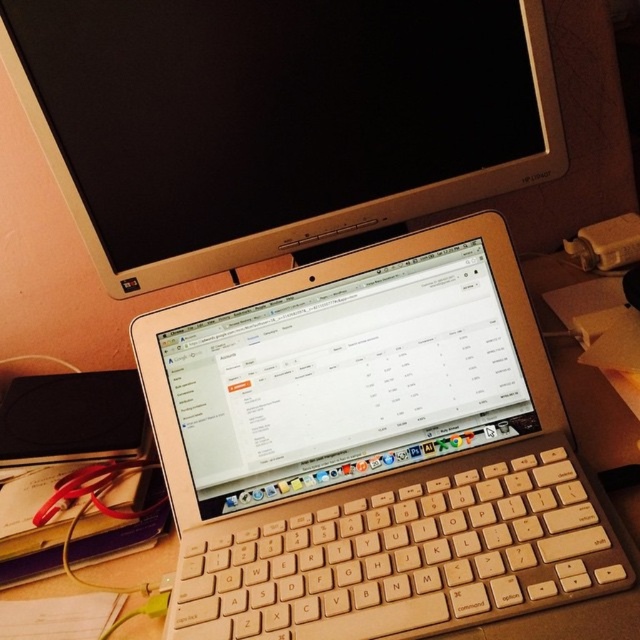
Which is in front, point (113, 141) or point (593, 516)?

Point (593, 516) is more forward.

Does satin gold monitor at upper center have a lesser height compared to beige wood keyboard at center?

Incorrect, satin gold monitor at upper center's height does not fall short of beige wood keyboard at center's.

What do you see at coordinates (275, 120) in the screenshot? This screenshot has width=640, height=640. I see `satin gold monitor at upper center` at bounding box center [275, 120].

Locate an element on the screen. This screenshot has width=640, height=640. satin gold monitor at upper center is located at coordinates (275, 120).

Does silver metallic laptop at center appear over satin gold monitor at upper center?

Actually, silver metallic laptop at center is below satin gold monitor at upper center.

Who is more distant from viewer, (212, 540) or (349, 72)?

The point (349, 72) is more distant.

This screenshot has height=640, width=640. I want to click on silver metallic laptop at center, so click(x=378, y=456).

Can you confirm if silver metallic laptop at center is shorter than beige wood keyboard at center?

Incorrect, silver metallic laptop at center's height does not fall short of beige wood keyboard at center's.

Looking at this image, which of these two, silver metallic laptop at center or beige wood keyboard at center, stands shorter?

beige wood keyboard at center

Who is more distant from viewer, (452,440) or (540,461)?

Positioned behind is point (452,440).

Identify the location of silver metallic laptop at center. Image resolution: width=640 pixels, height=640 pixels. (378, 456).